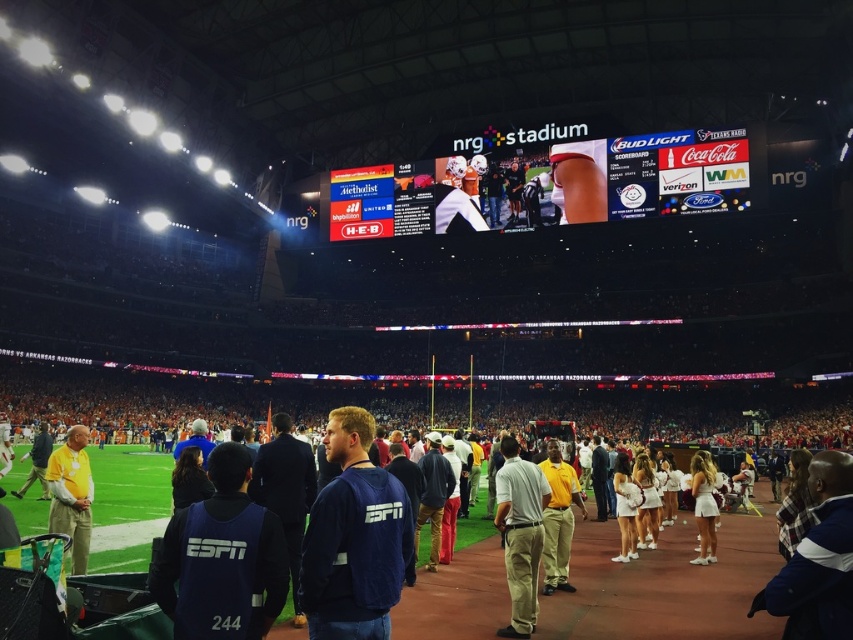
You are a photographer standing at the edge of the field in NRG Stadium during a football game between Texas Longhorns and Arkansas Razorbacks. You want to take a photo of the khaki pants at center. According to the coordinates provided, where should you aim your camera?

The khaki pants at center is located at point (x=520, y=534), so you should aim your camera towards that coordinate to capture it.

You are a photographer at the event and want to capture a photo that includes both the dark blue suit at center and the yellow matte shirt at lower left. Based on their positions, which one should you place on the right side of your frame to include both in the shot?

The dark blue suit at center is already positioned on the right side of the yellow matte shirt at lower left. To include both in the shot, you should place the dark blue suit at center on the right side of your frame.